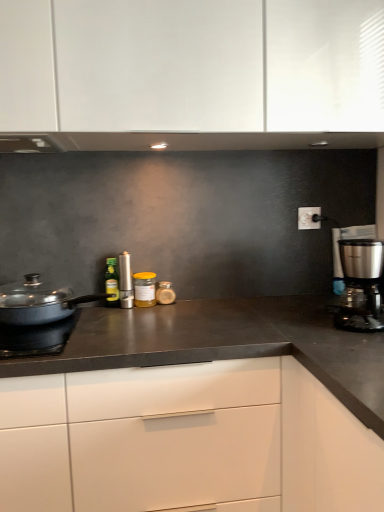
Question: Is satin silver canister at center, the fourth kitchen appliance positioned from the back, completely or partially outside of white matte cabinet at center?

Choices:
 (A) no
 (B) yes

Answer: (B)

Question: Considering the relative positions of satin silver canister at center, arranged as the second kitchen appliance when viewed from the front, and white matte cabinet at center in the image provided, is satin silver canister at center, arranged as the second kitchen appliance when viewed from the front, to the left of white matte cabinet at center from the viewer's perspective?

Choices:
 (A) no
 (B) yes

Answer: (B)

Question: From a real-world perspective, is satin silver canister at center, the fourth kitchen appliance positioned from the back, below white matte cabinet at center?

Choices:
 (A) yes
 (B) no

Answer: (B)

Question: Can you confirm if satin silver canister at center, the fourth kitchen appliance viewed from the right, is wider than white matte cabinet at center?

Choices:
 (A) no
 (B) yes

Answer: (A)

Question: Does satin silver canister at center, the second kitchen appliance when ordered from left to right, have a larger size compared to white matte cabinet at center?

Choices:
 (A) yes
 (B) no

Answer: (B)

Question: Considering the positions of matte black pan at left and matte black pan at left in the image, is matte black pan at left wider or thinner than matte black pan at left?

Choices:
 (A) thin
 (B) wide

Answer: (A)

Question: From the image's perspective, relative to matte black pan at left, is matte black pan at left above or below?

Choices:
 (A) above
 (B) below

Answer: (A)

Question: Is matte black pan at left bigger or smaller than matte black pan at left?

Choices:
 (A) small
 (B) big

Answer: (B)

Question: Would you say matte black pan at left is to the left or to the right of matte black pan at left in the picture?

Choices:
 (A) left
 (B) right

Answer: (B)

Question: From the image's perspective, relative to white matte cabinet at center, is green glass bottle at center, the 2th kitchen appliance in the back-to-front sequence, above or below?

Choices:
 (A) below
 (B) above

Answer: (B)

Question: Considering the positions of green glass bottle at center, the 2th kitchen appliance in the back-to-front sequence, and white matte cabinet at center in the image, is green glass bottle at center, the 2th kitchen appliance in the back-to-front sequence, bigger or smaller than white matte cabinet at center?

Choices:
 (A) small
 (B) big

Answer: (A)

Question: Looking at their shapes, would you say green glass bottle at center, marked as the fourth kitchen appliance in a front-to-back arrangement, is wider or thinner than white matte cabinet at center?

Choices:
 (A) thin
 (B) wide

Answer: (A)

Question: From a real-world perspective, is green glass bottle at center, which appears as the first kitchen appliance when viewed from the left, positioned above or below white matte cabinet at center?

Choices:
 (A) below
 (B) above

Answer: (B)

Question: Is translucent glass jar at center, marked as the 1th kitchen appliance in a back-to-front arrangement, wider or thinner than white matte cabinet at center?

Choices:
 (A) thin
 (B) wide

Answer: (A)

Question: From a real-world perspective, is translucent glass jar at center, marked as the 1th kitchen appliance in a back-to-front arrangement, positioned above or below white matte cabinet at center?

Choices:
 (A) above
 (B) below

Answer: (A)